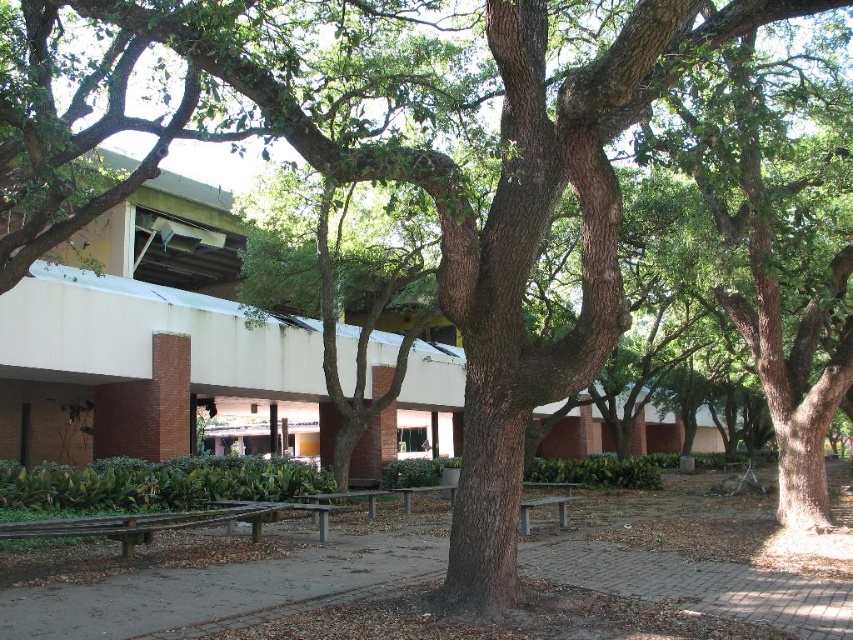
You are sitting on the gray wood park bench at center and want to see over the wooden park bench at center to look at the tree. Can you see over it?

The gray wood park bench at center is taller than the wooden park bench at center, so yes, you can see over the wooden park bench at center from the gray wood park bench at center.

You are standing at the entrance of the modern building in the background and want to find the wooden bench at center. According to the coordinates provided, in which direction should you walk to reach it?

The wooden bench at center is located at coordinates point (345, 497). Since the coordinate system typically places (0, 0) at the bottom left corner, moving towards higher x values means moving to the right and higher y values mean moving upwards. Therefore, to reach the wooden bench at center, you should walk to the right and slightly upwards from the entrance of the modern building in the background.